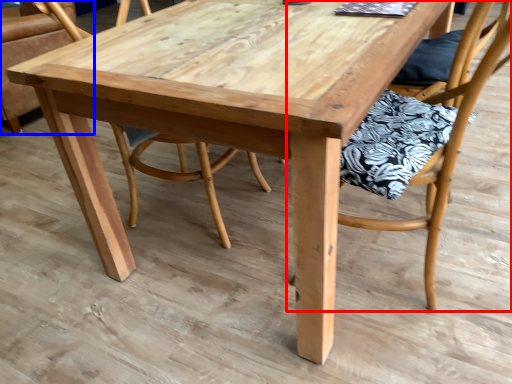
Question: Which point is closer to the camera, chair (highlighted by a red box) or chair (highlighted by a blue box)?

Choices:
 (A) chair
 (B) chair

Answer: (A)